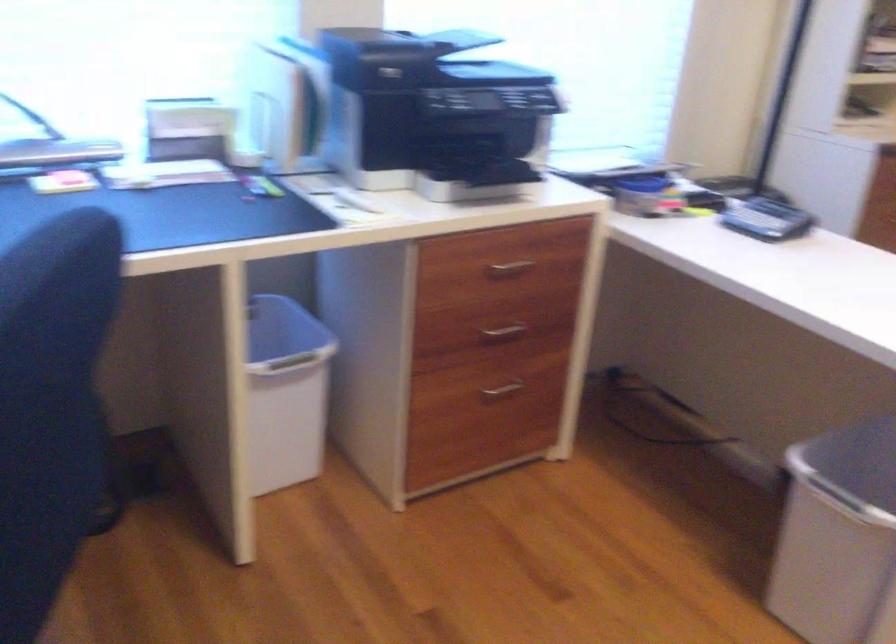
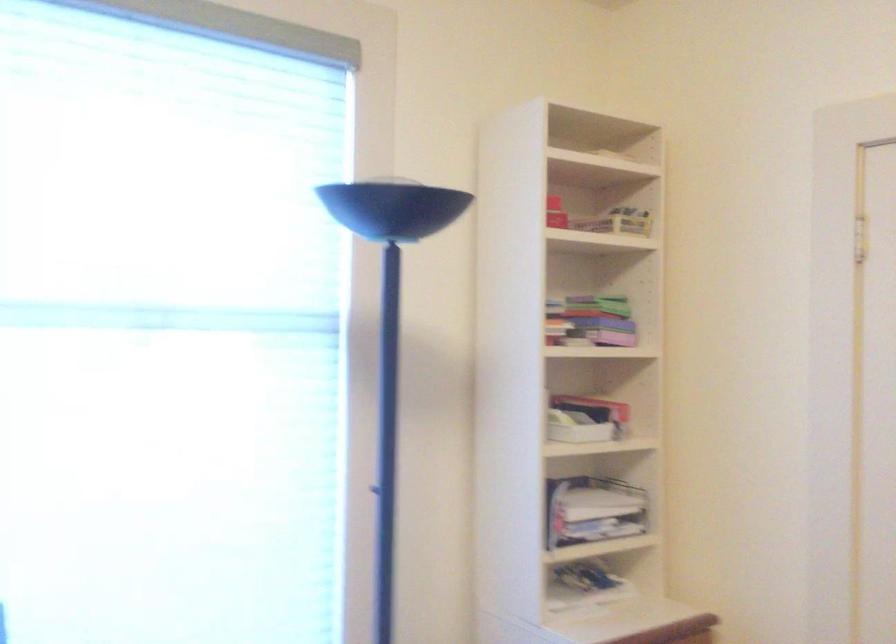
Question: Based on the continuous images, in which direction is the camera rotating? Reply with the corresponding letter.

Choices:
 (A) Left
 (B) Right
 (C) Up
 (D) Down

Answer: (C)